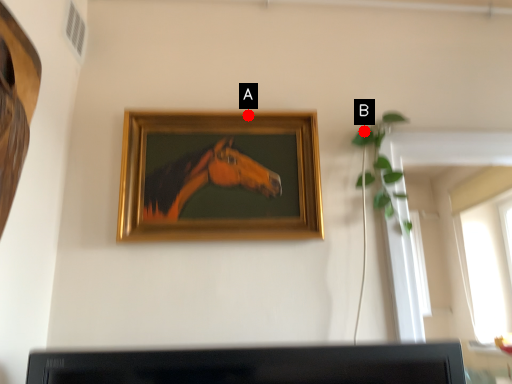
Question: Two points are circled on the image, labeled by A and B beside each circle. Which of the following is the closest to the observer?

Choices:
 (A) A is closer
 (B) B is closer

Answer: (A)